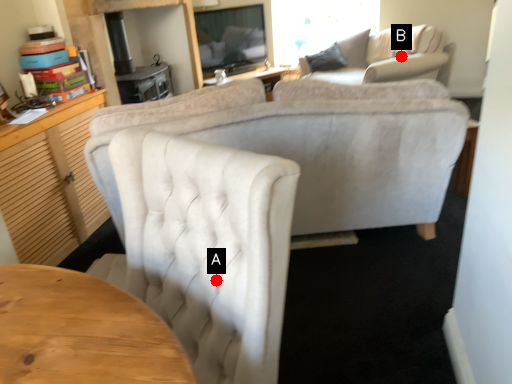
Question: Two points are circled on the image, labeled by A and B beside each circle. Which point is farther to the camera?

Choices:
 (A) A is further
 (B) B is further

Answer: (B)